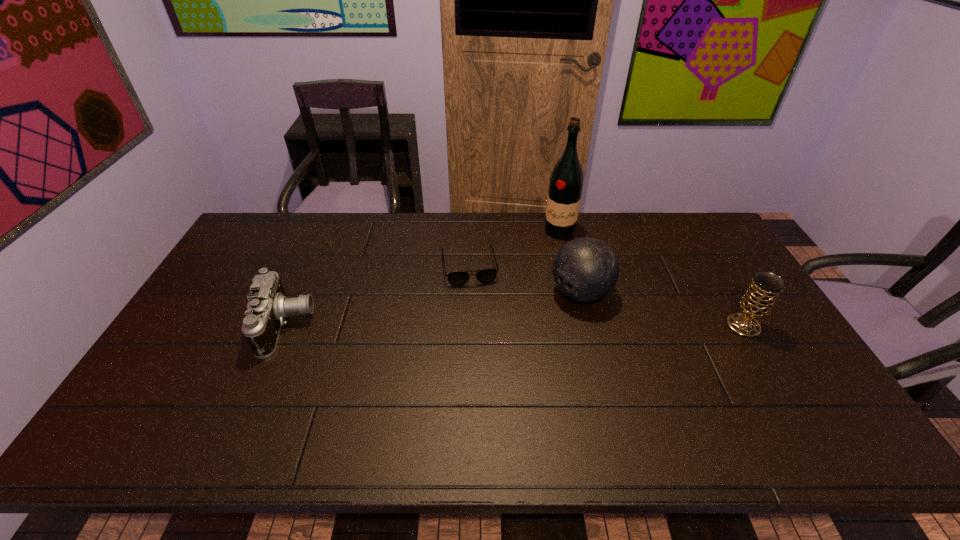
Find the location of a particular element. The width and height of the screenshot is (960, 540). liquor that is at the far edge is located at coordinates (566, 181).

Locate an element on the screen. The width and height of the screenshot is (960, 540). object at the right edge is located at coordinates (758, 300).

At what (x,y) coordinates should I click in order to perform the action: click on free space at the far edge of the desktop. Please return your answer as a coordinate pair (x, y). The image size is (960, 540). Looking at the image, I should click on (368, 230).

Identify the location of blank space at the near edge of the desktop. (463, 407).

The width and height of the screenshot is (960, 540). Find the location of `vacant space at the right edge of the desktop`. vacant space at the right edge of the desktop is located at coordinates [698, 278].

This screenshot has width=960, height=540. In order to click on vacant space at the far left corner in this screenshot , I will do `click(260, 241)`.

The image size is (960, 540). Find the location of `free point between the second object from left to right and the bowling ball`. free point between the second object from left to right and the bowling ball is located at coordinates (525, 280).

This screenshot has height=540, width=960. I want to click on free space between the shortest object and the camera, so click(x=377, y=296).

You are a GUI agent. You are given a task and a screenshot of the screen. Output one action in this format:
    pyautogui.click(x=<x>, y=<y>)
    Task: Click on the vacant space that is in between the farthest object and the chalice
    The image size is (960, 540).
    Given the screenshot: What is the action you would take?
    pyautogui.click(x=652, y=279)

Locate an element on the screen. This screenshot has width=960, height=540. vacant space that is in between the liquor and the chalice is located at coordinates (652, 279).